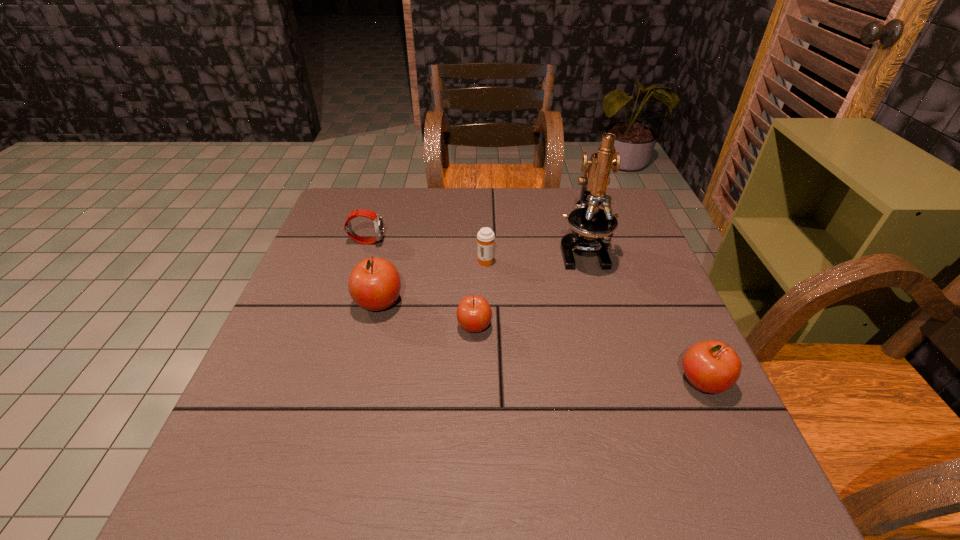
The image size is (960, 540). Find the location of `free space located 0.200m on the front of the second apple from right to left`. free space located 0.200m on the front of the second apple from right to left is located at coordinates (473, 425).

Locate an element on the screen. vacant point located 0.130m on the back of the second tallest apple is located at coordinates (672, 316).

In order to click on free region located 0.380m at the eyepiece of the tallest object in this screenshot , I will do `click(628, 411)`.

This screenshot has width=960, height=540. Find the location of `vacant space located 0.230m on the right of the medicine`. vacant space located 0.230m on the right of the medicine is located at coordinates (583, 260).

Locate an element on the screen. free location located on the face of the watch is located at coordinates (516, 241).

Where is `object located in the far edge section of the desktop`? The height and width of the screenshot is (540, 960). object located in the far edge section of the desktop is located at coordinates (588, 222).

You are a GUI agent. You are given a task and a screenshot of the screen. Output one action in this format:
    pyautogui.click(x=<x>, y=<y>)
    Task: Click on the apple that is at the left edge
    This screenshot has width=960, height=540.
    Given the screenshot: What is the action you would take?
    pyautogui.click(x=374, y=284)

You are a GUI agent. You are given a task and a screenshot of the screen. Output one action in this format:
    pyautogui.click(x=<x>, y=<y>)
    Task: Click on the watch present at the left edge
    
    Given the screenshot: What is the action you would take?
    pyautogui.click(x=377, y=219)

This screenshot has width=960, height=540. In order to click on apple present at the right edge in this screenshot , I will do `click(712, 366)`.

Find the location of a particular element. This screenshot has width=960, height=540. microscope that is at the right edge is located at coordinates (588, 222).